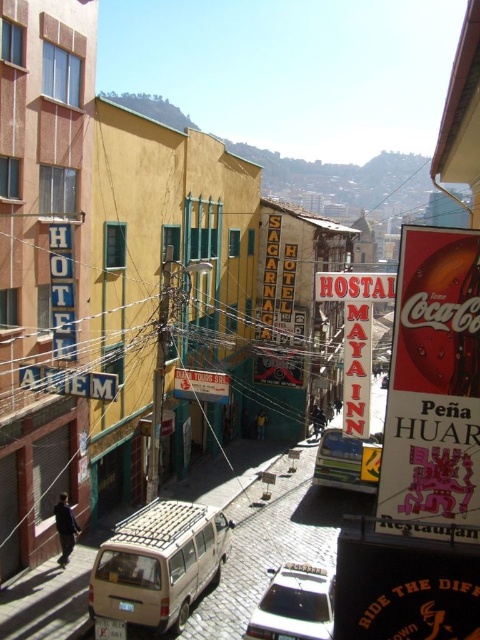
Question: Which point is closer to the camera?

Choices:
 (A) red cardboard coca-cola sign at right
 (B) metallic silver van at center
 (C) beige matte van at lower center
 (D) white glossy car at center

Answer: (A)

Question: Which point appears farthest from the camera in this image?

Choices:
 (A) (321, 586)
 (B) (319, 449)
 (C) (172, 506)

Answer: (B)

Question: Does red cardboard coca-cola sign at right appear on the right side of white glossy car at center?

Choices:
 (A) yes
 (B) no

Answer: (A)

Question: Which of the following is the closest to the observer?

Choices:
 (A) metallic silver van at center
 (B) white glossy car at center

Answer: (B)

Question: Is white glossy car at center to the left of metallic silver van at center from the viewer's perspective?

Choices:
 (A) no
 (B) yes

Answer: (B)

Question: Is white glossy car at center above metallic silver van at center?

Choices:
 (A) no
 (B) yes

Answer: (A)